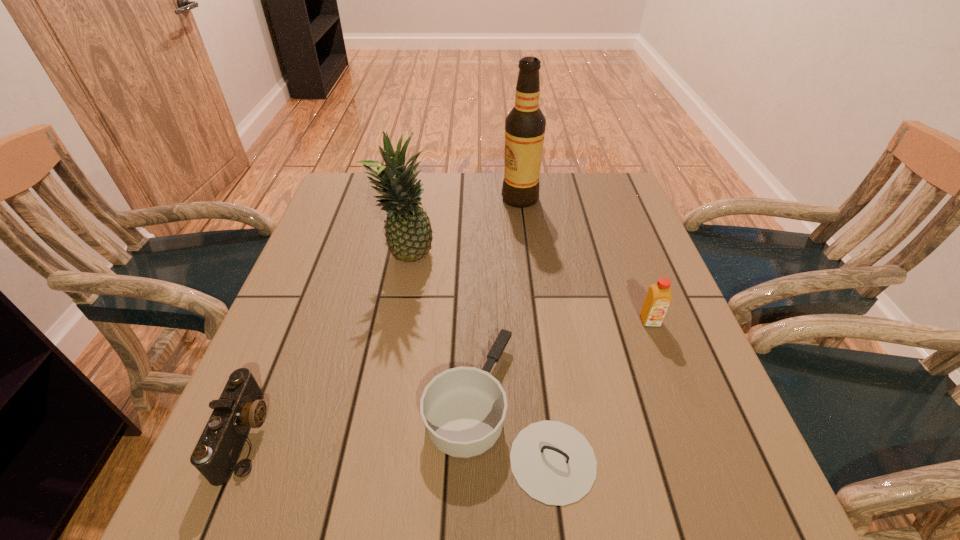
You are a GUI agent. You are given a task and a screenshot of the screen. Output one action in this format:
    pyautogui.click(x=<x>, y=<y>)
    Task: Click on the farthest object
    
    Given the screenshot: What is the action you would take?
    pyautogui.click(x=525, y=125)

This screenshot has width=960, height=540. Find the location of `alcohol`. alcohol is located at coordinates (525, 125).

The height and width of the screenshot is (540, 960). I want to click on the second object from left to right, so click(x=408, y=232).

Locate an element on the screen. pineapple is located at coordinates (408, 232).

Locate an element on the screen. The image size is (960, 540). the third tallest object is located at coordinates (659, 296).

Locate an element on the screen. Image resolution: width=960 pixels, height=540 pixels. the rightmost object is located at coordinates coord(659,296).

Where is `camera`? The image size is (960, 540). camera is located at coordinates (240, 407).

You are a GUI agent. You are given a task and a screenshot of the screen. Output one action in this format:
    pyautogui.click(x=<x>, y=<y>)
    Task: Click on the leftmost object
    
    Given the screenshot: What is the action you would take?
    pyautogui.click(x=240, y=407)

Locate an element on the screen. saucepan is located at coordinates (463, 408).

Where is `free space located 0.330m on the label of the alcohol`? free space located 0.330m on the label of the alcohol is located at coordinates (391, 199).